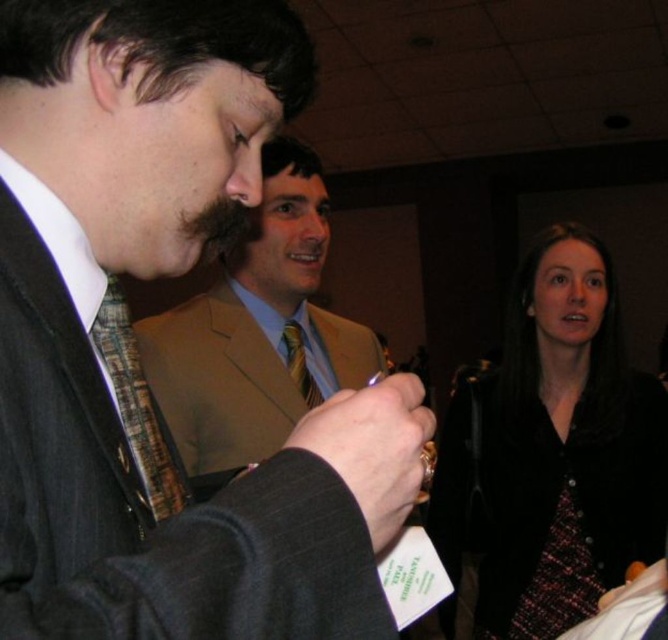
You are standing in the center of the room and want to hand a document to the person wearing the light brown suit at center. Which direction should you move to reach them?

The light brown suit at center is located at point [255,330], so you should move towards the center of the room to reach them.

You are a photographer at a formal event. You need to capture a clear photo of the matte black suit at center without the plaid fabric tie at center appearing in the background. Is this possible based on their positions?

The matte black suit at center is in front of the plaid fabric tie at center, so yes, the photographer can capture a clear photo of the matte black suit at center without the plaid fabric tie at center appearing in the background by focusing on the foreground.

In the scene described, there are two items of clothing at the center of the image. The light brown suit at center and the plaid fabric tie at center. From the perspective of someone facing the scene, which one is positioned to the right?

The light brown suit at center is to the right of the plaid fabric tie at center, so the light brown suit at center is positioned to the right.